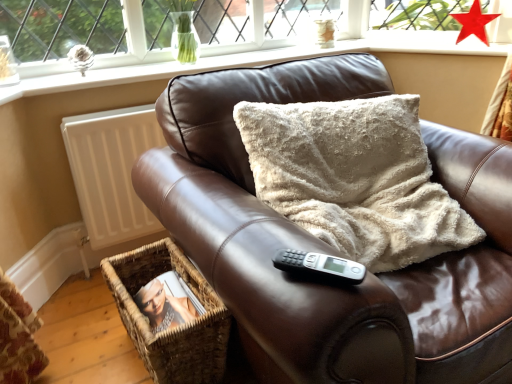
Question: Visually, is smooth white surface at upper center positioned to the left or to the right of brown leather couch at center?

Choices:
 (A) right
 (B) left

Answer: (B)

Question: From a real-world perspective, is smooth white surface at upper center positioned above or below brown leather couch at center?

Choices:
 (A) below
 (B) above

Answer: (B)

Question: Which object is the closest to the smooth white surface at upper center?

Choices:
 (A) woven brown basket at lower left
 (B) white matte radiator at left
 (C) black plastic remote at center
 (D) brown leather couch at center
 (E) red glass star at upper right

Answer: (B)

Question: Estimate the real-world distances between objects in this image. Which object is farther from the woven brown basket at lower left?

Choices:
 (A) brown leather couch at center
 (B) white matte radiator at left
 (C) red glass star at upper right
 (D) black plastic remote at center
 (E) smooth white surface at upper center

Answer: (C)